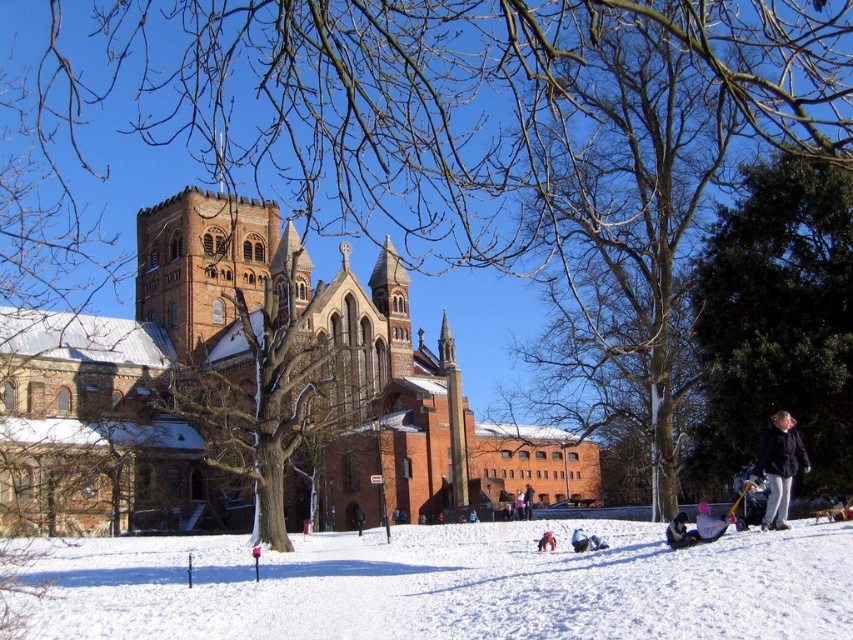
Question: Which object is the closest to the light pink fabric at lower center?

Choices:
 (A) dark blue jacket at lower right
 (B) brown stone church at center
 (C) white fluffy snow at lower center

Answer: (A)

Question: Considering the real-world distances, which object is closest to the white fluffy snow at lower center?

Choices:
 (A) light pink fabric at lower center
 (B) dark blue jacket at lower right

Answer: (A)

Question: Can you confirm if white fluffy snow at lower center is thinner than light pink fabric at lower center?

Choices:
 (A) yes
 (B) no

Answer: (B)

Question: Can you confirm if dark blue jacket at lower right is positioned to the right of light pink fabric at lower center?

Choices:
 (A) yes
 (B) no

Answer: (A)

Question: Can you confirm if white fluffy snow at lower center is thinner than light pink fabric at lower center?

Choices:
 (A) yes
 (B) no

Answer: (B)

Question: Which object is closer to the camera taking this photo?

Choices:
 (A) dark blue jacket at lower right
 (B) white fluffy snow at lower center

Answer: (B)